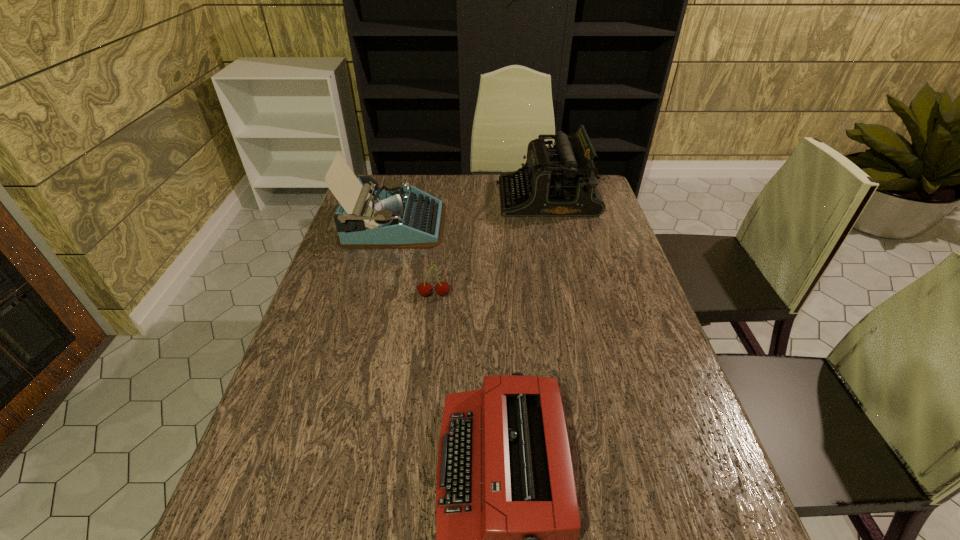
At what (x,y) coordinates should I click in order to perform the action: click on free space at the right edge of the desktop. Please return your answer as a coordinate pair (x, y). The height and width of the screenshot is (540, 960). Looking at the image, I should click on (604, 295).

Identify the location of empty space that is in between the cherry and the leftmost typewriter. The image size is (960, 540). (414, 260).

Find the location of a particular element. The width and height of the screenshot is (960, 540). free space that is in between the leftmost typewriter and the cherry is located at coordinates tap(414, 260).

This screenshot has height=540, width=960. I want to click on the closest object to the cherry, so click(x=394, y=217).

Select which object is the third closest to the cherry. Please provide its 2D coordinates. Your answer should be formatted as a tuple, i.e. [(x, y)], where the tuple contains the x and y coordinates of a point satisfying the conditions above.

[(561, 181)]

Locate an element on the screen. The height and width of the screenshot is (540, 960). the closest typewriter to the shortest typewriter is located at coordinates (394, 217).

Select which typewriter is the closest to the leftmost typewriter. Please provide its 2D coordinates. Your answer should be formatted as a tuple, i.e. [(x, y)], where the tuple contains the x and y coordinates of a point satisfying the conditions above.

[(561, 181)]